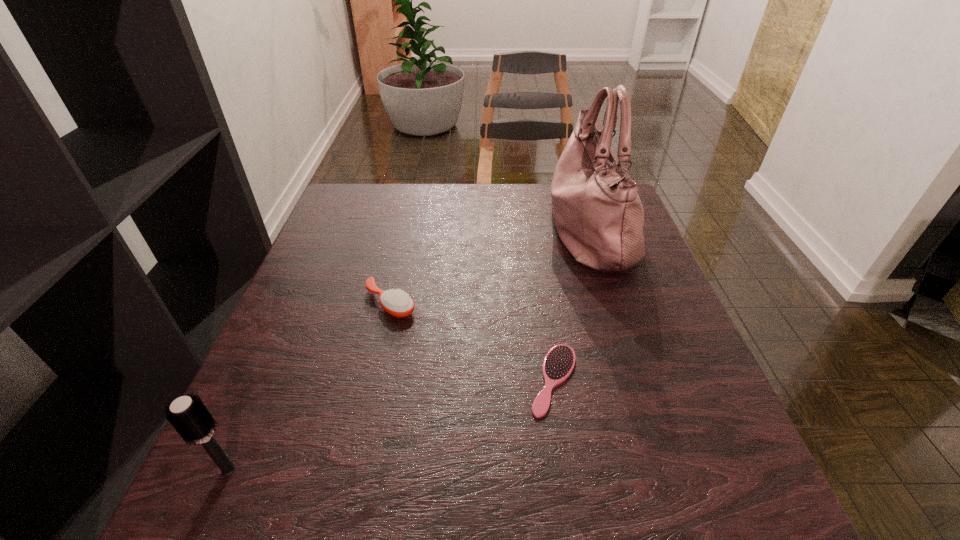
At what (x,y) coordinates should I click in order to perform the action: click on the farthest object. Please return your answer as a coordinate pair (x, y). The height and width of the screenshot is (540, 960). Looking at the image, I should click on (599, 217).

Identify the location of the tallest object. The image size is (960, 540). (599, 217).

This screenshot has height=540, width=960. What are the coordinates of `the nearest hairbrush` in the screenshot? It's located at (188, 415).

This screenshot has height=540, width=960. Find the location of `the leftmost object`. the leftmost object is located at coordinates (188, 415).

This screenshot has width=960, height=540. Find the location of `the third tallest object`. the third tallest object is located at coordinates (396, 302).

Locate an element on the screen. This screenshot has height=540, width=960. the second object from left to right is located at coordinates (396, 302).

Locate an element on the screen. The height and width of the screenshot is (540, 960). the shortest hairbrush is located at coordinates (559, 362).

Where is `the rightmost hairbrush`? The width and height of the screenshot is (960, 540). the rightmost hairbrush is located at coordinates (559, 362).

The height and width of the screenshot is (540, 960). I want to click on vacant space situated at the front of the tallest object with handles, so click(452, 231).

Image resolution: width=960 pixels, height=540 pixels. Find the location of `free space located 0.170m at the front of the tallest object with handles`. free space located 0.170m at the front of the tallest object with handles is located at coordinates (483, 231).